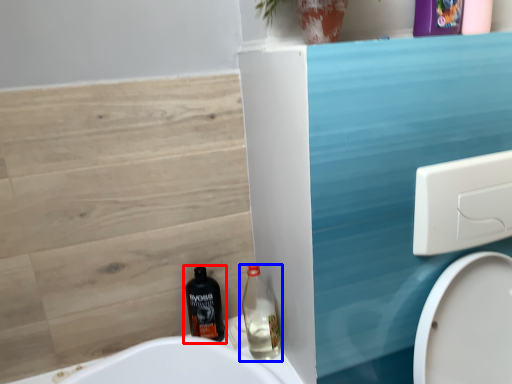
Question: Which of the following is the closest to the observer, bottle (highlighted by a red box) or bottle (highlighted by a blue box)?

Choices:
 (A) bottle
 (B) bottle

Answer: (B)